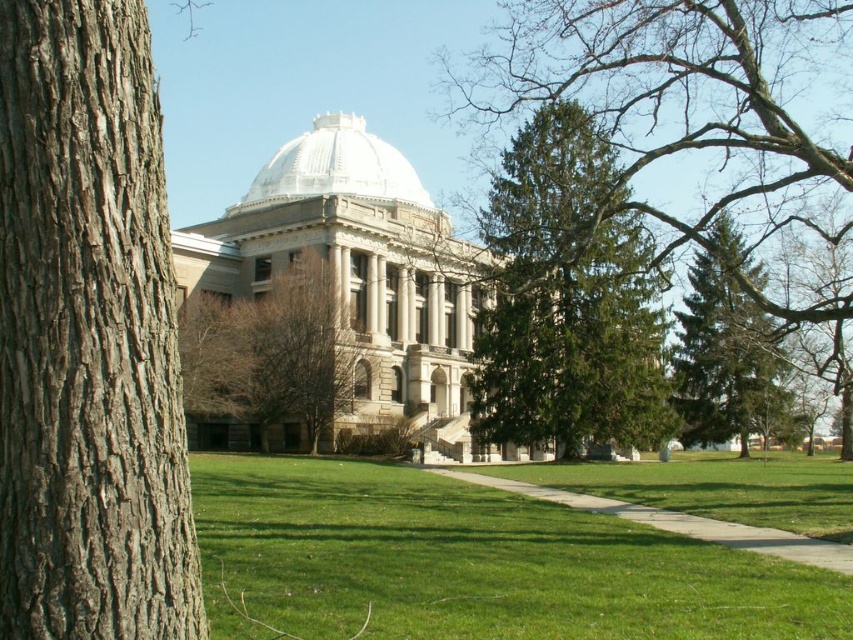
Is point (194, 580) positioned after point (384, 161)?

No, it is not.

I want to click on brown rough bark at left, so click(x=88, y=337).

Who is more forward, [267,608] or [805,241]?

Point [267,608] is more forward.

Does point (242, 529) come closer to viewer compared to point (850, 145)?

Yes, point (242, 529) is in front of point (850, 145).

Is point (267, 589) more distant than point (657, 77)?

No, (267, 589) is in front of (657, 77).

At what (x,y) coordinates should I click in order to perform the action: click on green grass at center. Please return your answer as a coordinate pair (x, y). Image resolution: width=853 pixels, height=640 pixels. Looking at the image, I should click on (474, 563).

This screenshot has height=640, width=853. What are the coordinates of `green evergreen tree at center` in the screenshot? It's located at (567, 298).

The width and height of the screenshot is (853, 640). What do you see at coordinates (567, 298) in the screenshot?
I see `green evergreen tree at center` at bounding box center [567, 298].

Where is `green evergreen tree at center`? This screenshot has height=640, width=853. green evergreen tree at center is located at coordinates (567, 298).